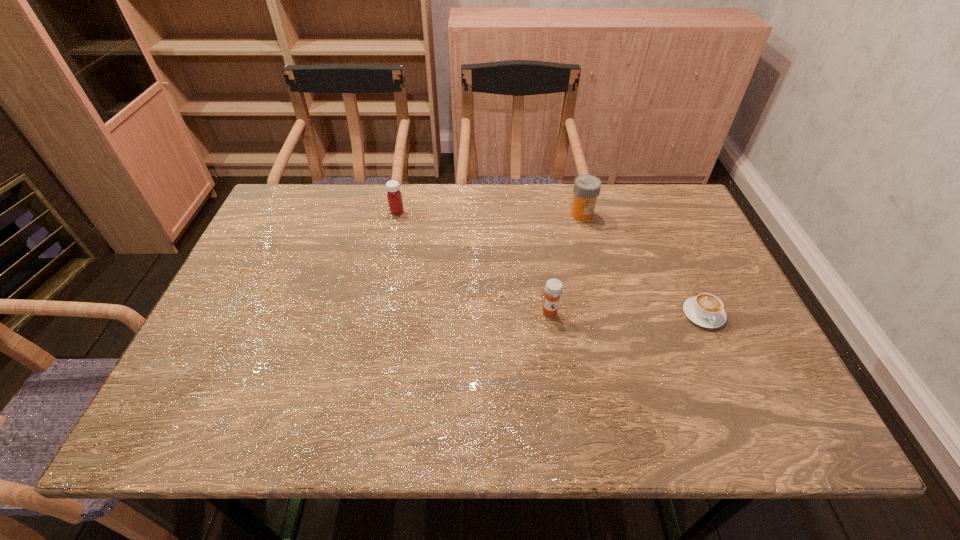
Find the location of a particular element. Image resolution: width=960 pixels, height=540 pixels. the rightmost medicine is located at coordinates (587, 187).

The width and height of the screenshot is (960, 540). I want to click on the leftmost object, so click(x=394, y=196).

Where is `the second object from left to right`? This screenshot has height=540, width=960. the second object from left to right is located at coordinates (553, 289).

This screenshot has height=540, width=960. In order to click on the second medicine from right to left in this screenshot , I will do `click(553, 289)`.

Identify the location of the shortest object. Image resolution: width=960 pixels, height=540 pixels. (706, 310).

Find the location of a particular element. This screenshot has width=960, height=540. cappuccino is located at coordinates (706, 310).

Image resolution: width=960 pixels, height=540 pixels. What are the coordinates of `free spot located 0.210m on the label side of the second object from right to left` in the screenshot? It's located at (597, 273).

Where is `free location located 0.080m on the left of the leftmost object`? Image resolution: width=960 pixels, height=540 pixels. free location located 0.080m on the left of the leftmost object is located at coordinates (363, 211).

Locate an element on the screen. The image size is (960, 540). vacant space situated 0.180m on the label side of the nearest medicine is located at coordinates (561, 387).

The height and width of the screenshot is (540, 960). What are the coordinates of `free spot located on the side of the shortest object with the handle` in the screenshot? It's located at (752, 421).